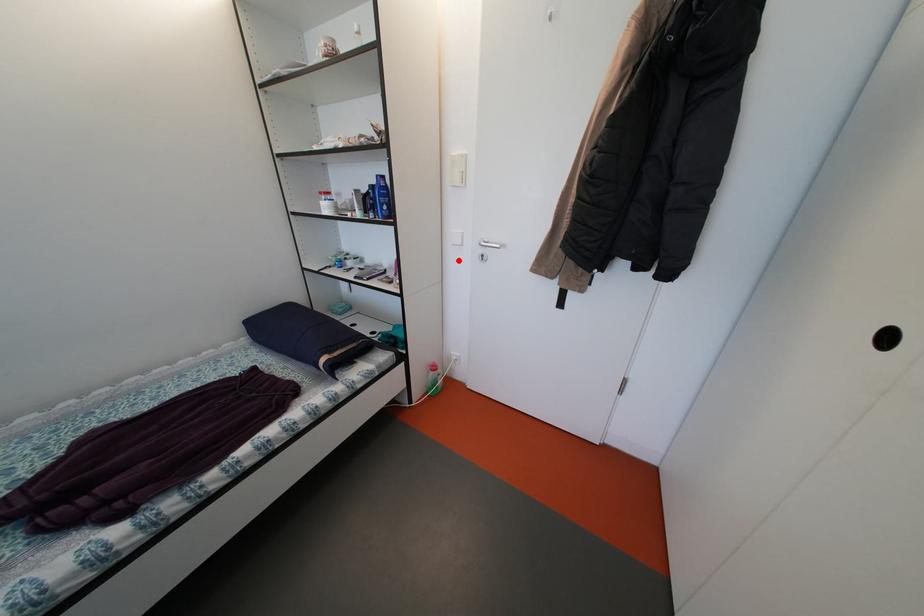
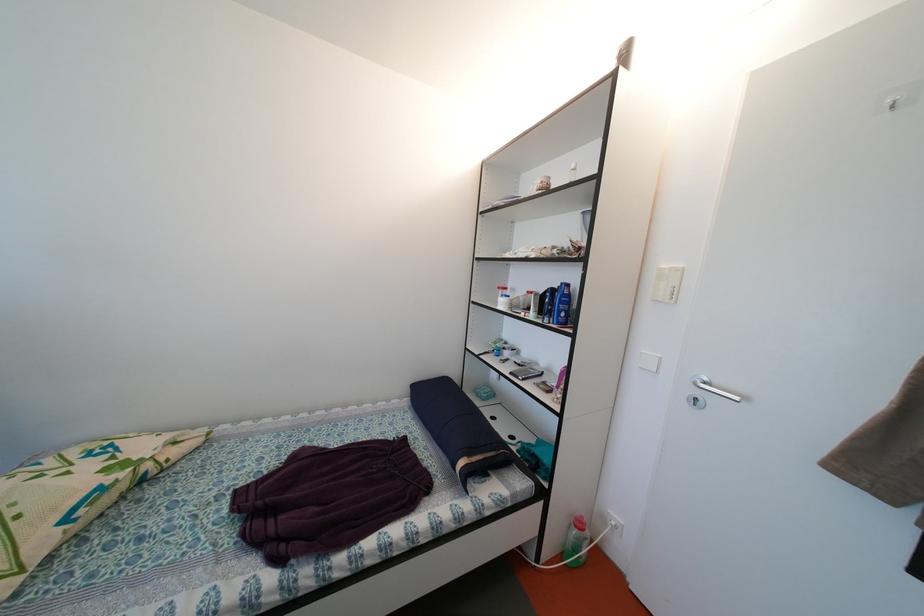
Question: I am providing you with two images of the same scene from different viewpoints. A red point is marked on the first image. Can you still see the location of the red point in image 2?

Choices:
 (A) Yes
 (B) No

Answer: (A)